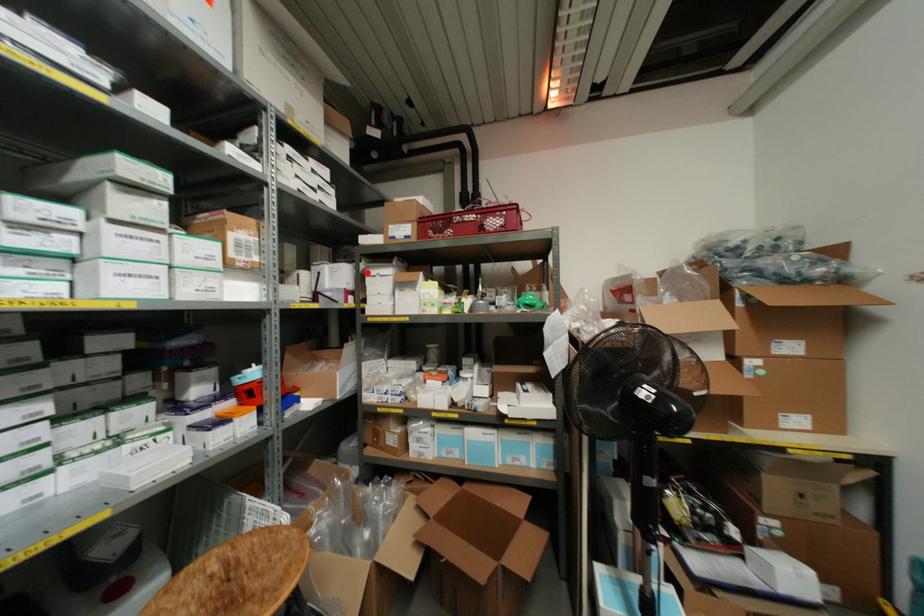
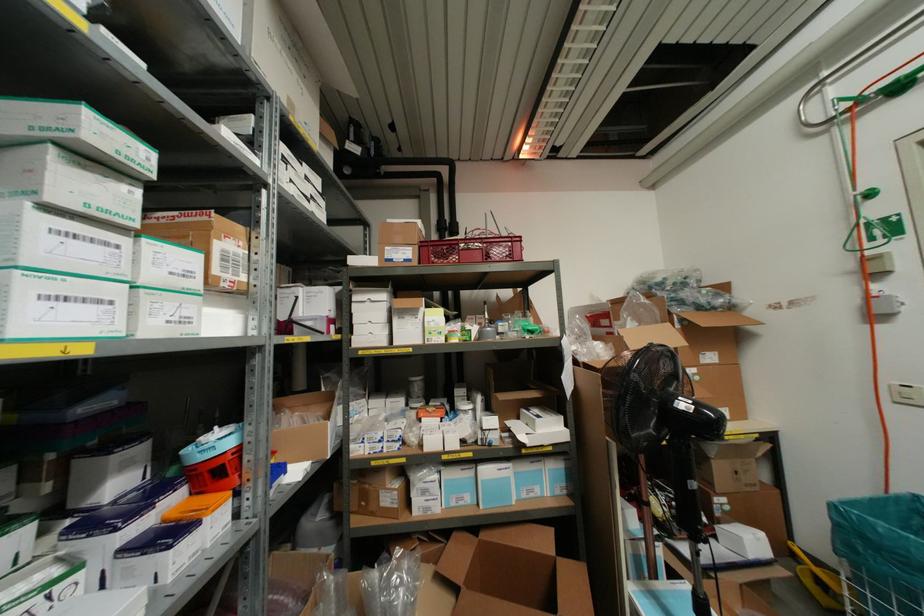
In the second image, find the point that corresponds to the highlighted location in the first image.

(354, 298)